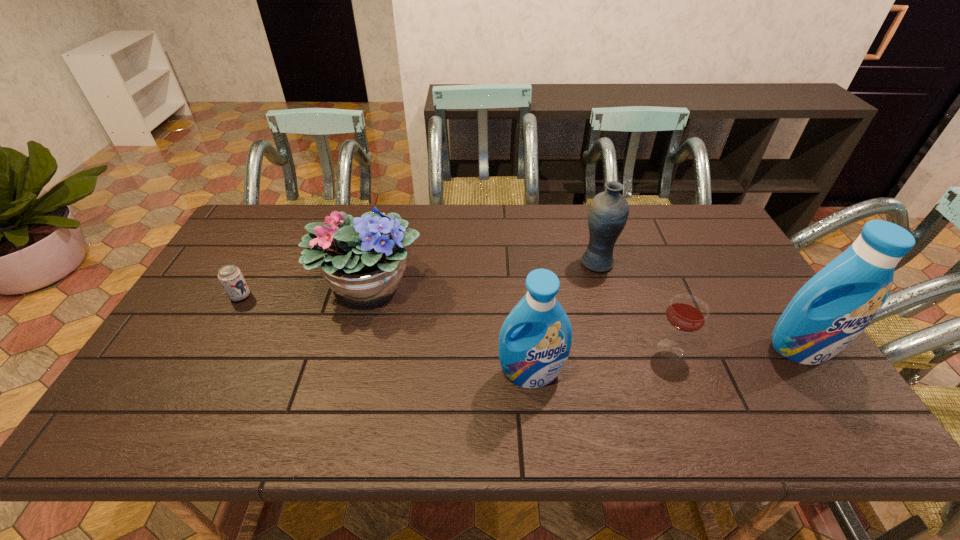
Find the location of a particular element. Image resolution: width=960 pixels, height=540 pixels. free region at the far left corner of the desktop is located at coordinates (275, 215).

In the image, there is a desktop. What are the coordinates of `vacant space at the far right corner` in the screenshot? It's located at (688, 205).

Locate an element on the screen. This screenshot has height=540, width=960. vacant space at the near right corner of the desktop is located at coordinates (816, 379).

Identify the location of empty location between the taller detergent and the left detergent. This screenshot has height=540, width=960. (666, 361).

I want to click on vacant space that's between the third object from left to right and the leftmost object, so click(386, 335).

Locate an element on the screen. The image size is (960, 540). free space between the shorter detergent and the fifth object from left to right is located at coordinates (601, 361).

The width and height of the screenshot is (960, 540). I want to click on blank region between the left detergent and the bouquet, so click(450, 329).

This screenshot has width=960, height=540. I want to click on vacant space that's between the right detergent and the fourth object from right to left, so click(x=666, y=361).

This screenshot has height=540, width=960. What are the coordinates of `object that stands as the third closest to the tallest object` in the screenshot? It's located at (535, 339).

Select which object appears as the fifth closest to the tallest object. Please provide its 2D coordinates. Your answer should be formatted as a tuple, i.e. [(x, y)], where the tuple contains the x and y coordinates of a point satisfying the conditions above.

[(230, 276)]